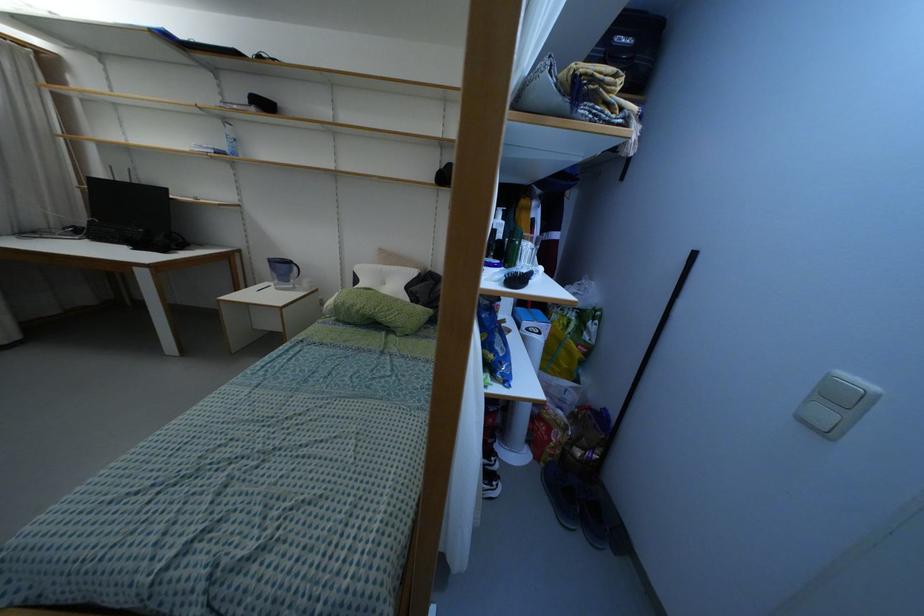
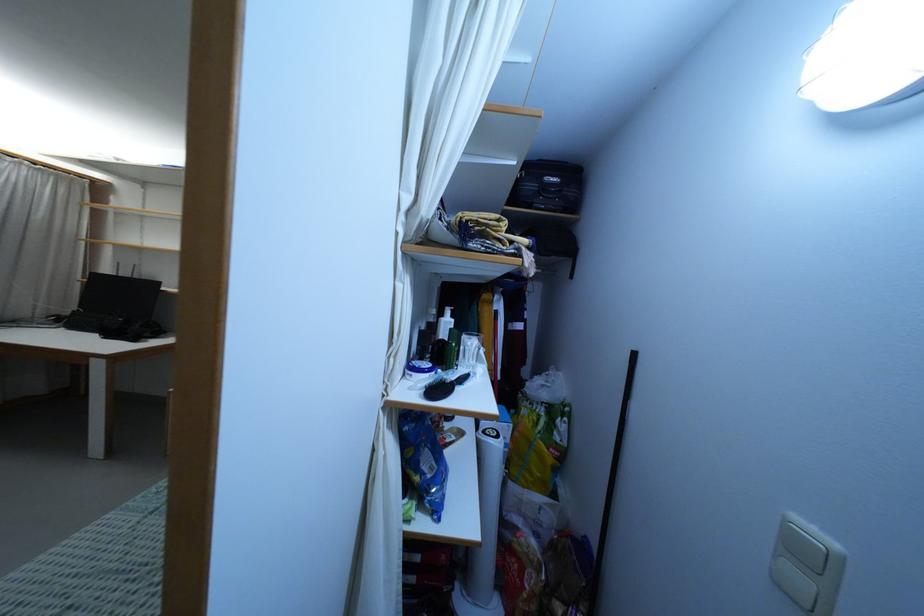
Locate, in the second image, the point that corresponds to the point at 495,353 in the first image.

(422, 474)